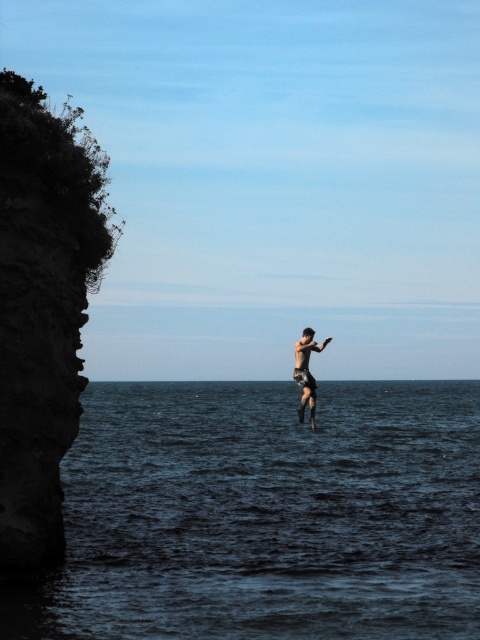
Based on the scene description, which object occupies a larger area in the image? The dark blue water at center or the skinny black shorts at center?

The dark blue water at center is bigger than the skinny black shorts at center according to the description.

You are a photographer trying to capture the contrast between the dark rock cliff at left and the skinny black shorts at center in your shot. Which object appears narrower in the image?

The dark rock cliff at left appears narrower than the skinny black shorts at center according to the description.

You are a drone operator trying to capture the best aerial shot of the coastal cliff. The drone is currently hovering at point (43, 307). What object is directly below the drone?

The dark rock cliff at left is directly below the point (43, 307).